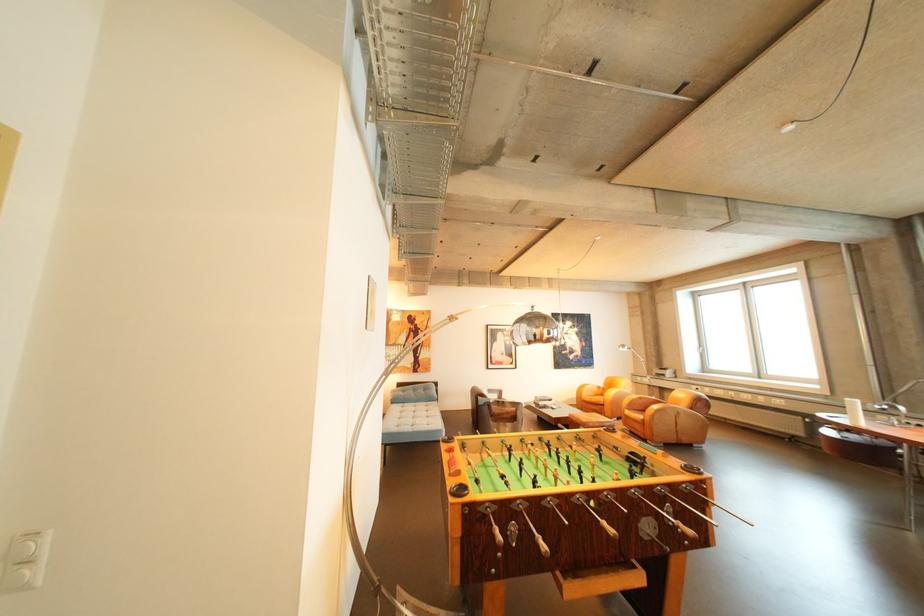
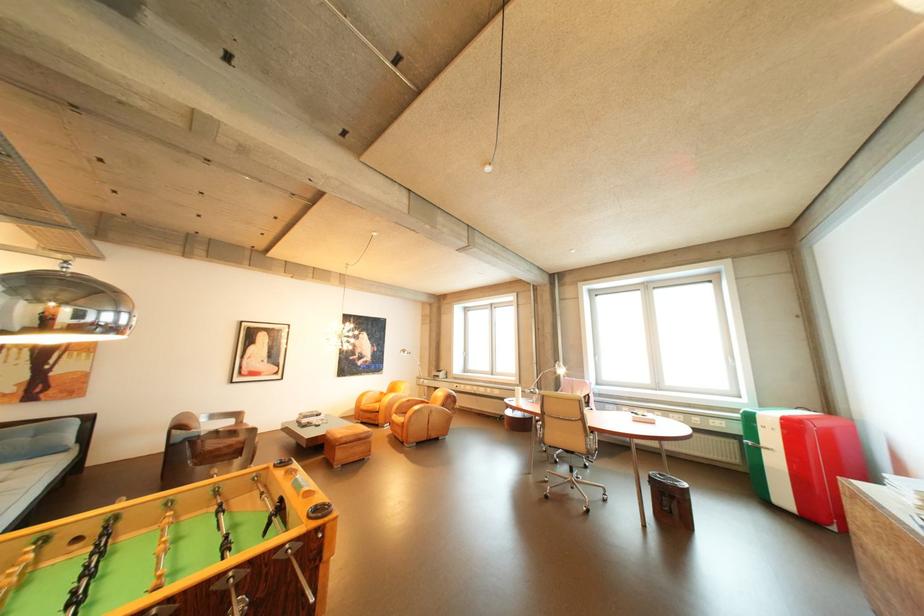
The point at (x=506, y=426) is marked in the first image. Where is the corresponding point in the second image?

(213, 469)